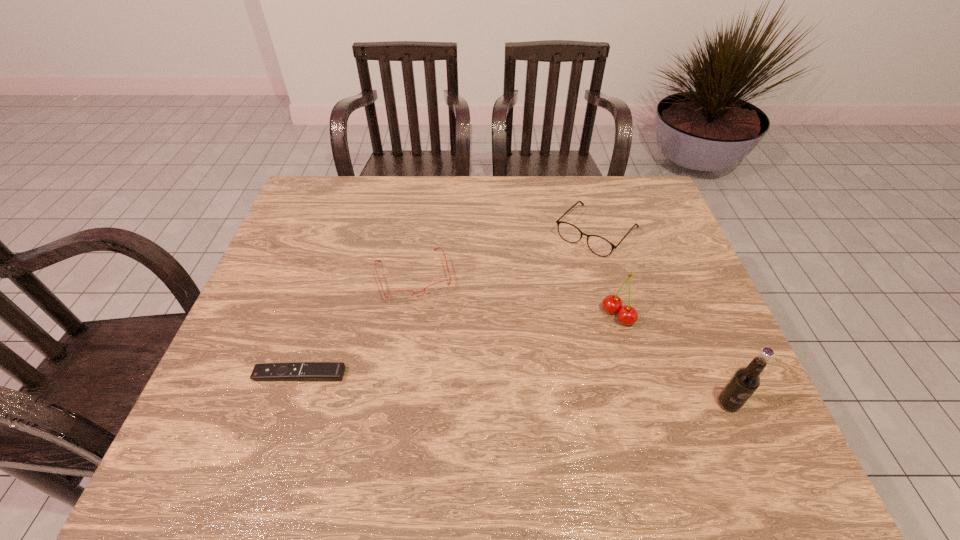
Identify the location of the fourth farthest object. (313, 371).

Locate an element on the screen. remote control is located at coordinates (313, 371).

Locate an element on the screen. The width and height of the screenshot is (960, 540). root beer is located at coordinates (743, 383).

Identify the location of the nearest object. The width and height of the screenshot is (960, 540). (743, 383).

At what (x,y) coordinates should I click in order to perform the action: click on the third shortest object. Please return your answer as a coordinate pair (x, y). The height and width of the screenshot is (540, 960). Looking at the image, I should click on (600, 246).

The width and height of the screenshot is (960, 540). Find the location of `the taller spectacles`. the taller spectacles is located at coordinates (600, 246).

Image resolution: width=960 pixels, height=540 pixels. Identify the location of the second tallest object. (627, 315).

Find the location of a particular element. Image resolution: width=960 pixels, height=540 pixels. the fourth object from right to left is located at coordinates (402, 295).

Locate an element on the screen. the shorter spectacles is located at coordinates point(402,295).

Identify the location of vacant region located on the front of the leftmost object. The width and height of the screenshot is (960, 540). (286, 416).